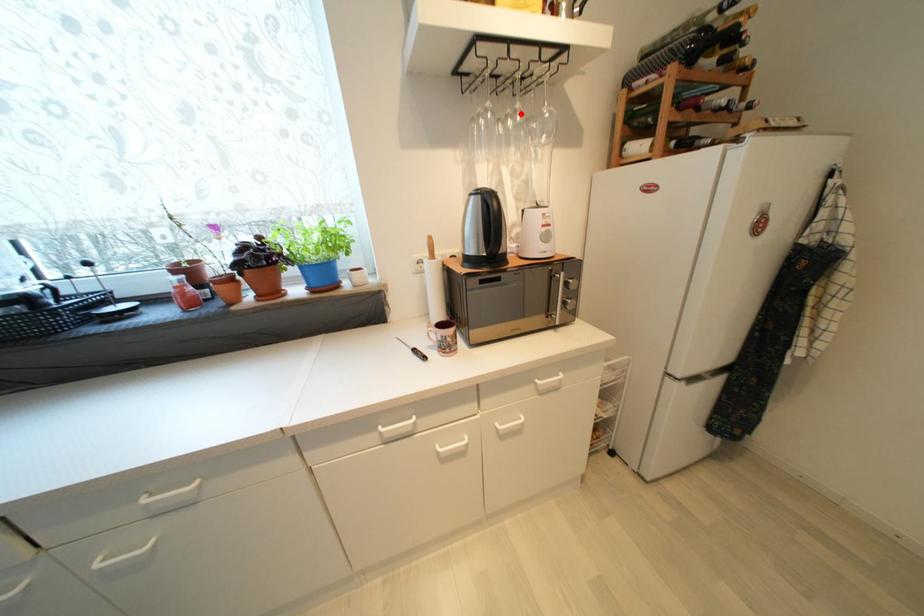
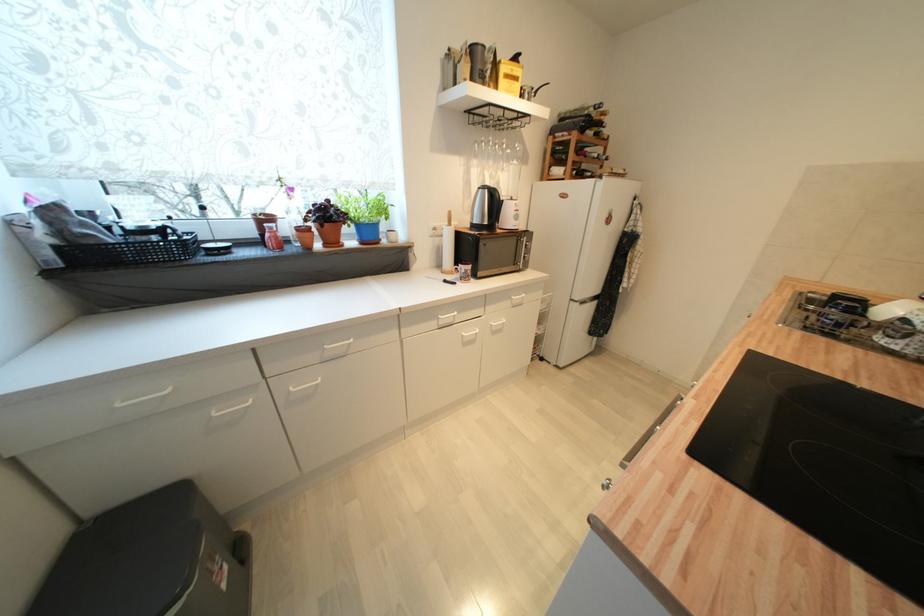
Where in the second image is the point corresponding to the highlighted location from the first image?

(507, 146)